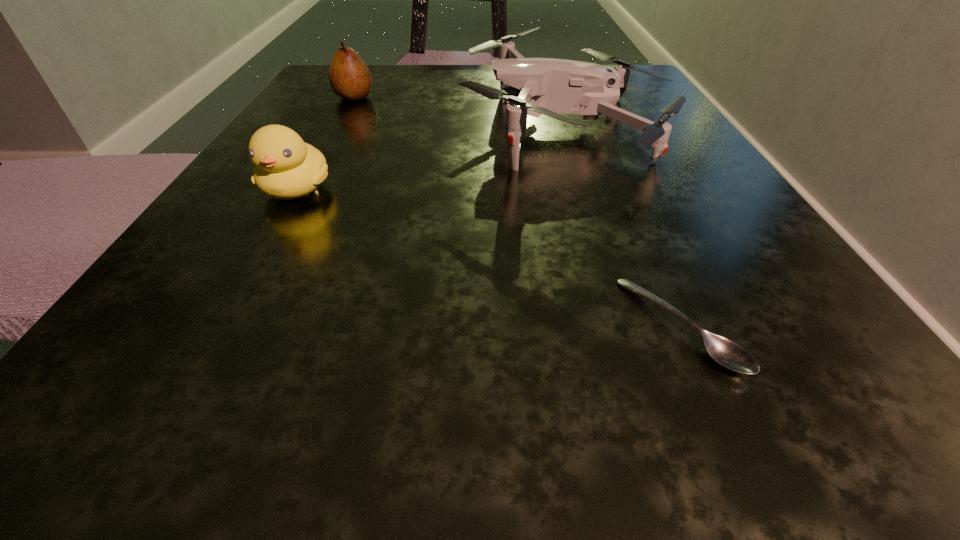
Locate an element on the screen. vacant space that satisfies the following two spatial constraints: 1. at the beak of the soupspoon; 2. on the left side of the duckling is located at coordinates (220, 326).

Find the location of a particular element. Image resolution: width=960 pixels, height=540 pixels. free space that satisfies the following two spatial constraints: 1. on the front side of the pear; 2. on the left side of the soupspoon is located at coordinates (230, 326).

This screenshot has width=960, height=540. In order to click on free space that satisfies the following two spatial constraints: 1. with a camera at the front of the drone; 2. on the right side of the soupspoon in this screenshot , I will do `click(631, 326)`.

Find the location of a particular element. free space in the image that satisfies the following two spatial constraints: 1. with a camera at the front of the drone; 2. on the left side of the shortest object is located at coordinates (631, 326).

Locate an element on the screen. This screenshot has height=540, width=960. free region that satisfies the following two spatial constraints: 1. on the front side of the pear; 2. on the right side of the soupspoon is located at coordinates (230, 326).